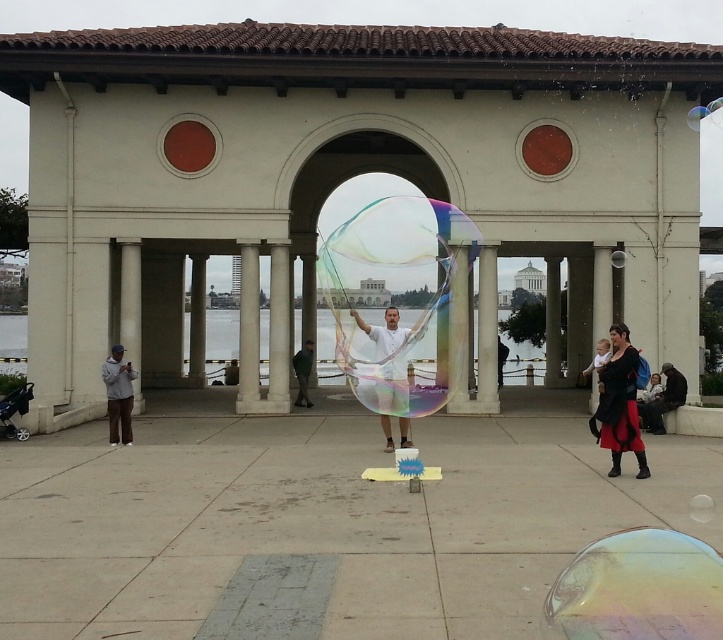
Question: Is black leather jacket at right to the right of dark gray fabric at center from the viewer's perspective?

Choices:
 (A) yes
 (B) no

Answer: (B)

Question: Which of the following is the closest to the observer?

Choices:
 (A) (658, 413)
 (B) (108, 424)
 (C) (722, 593)

Answer: (C)

Question: Which point is closer to the camera?

Choices:
 (A) (385, 444)
 (B) (497, 353)
 (C) (646, 403)

Answer: (A)

Question: Which object is positioned farthest from the gray hoodie at left?

Choices:
 (A) transparent iridescent bubble at center
 (B) dark gray fabric at center
 (C) translucent plastic bubble at center
 (D) dark gray sweater at lower right

Answer: (B)

Question: In this image, where is dark gray sweater at lower right located relative to green fabric pants at center?

Choices:
 (A) below
 (B) above

Answer: (A)

Question: Is transparent iridescent bubble at center to the left of white marble pillar at center from the viewer's perspective?

Choices:
 (A) no
 (B) yes

Answer: (A)